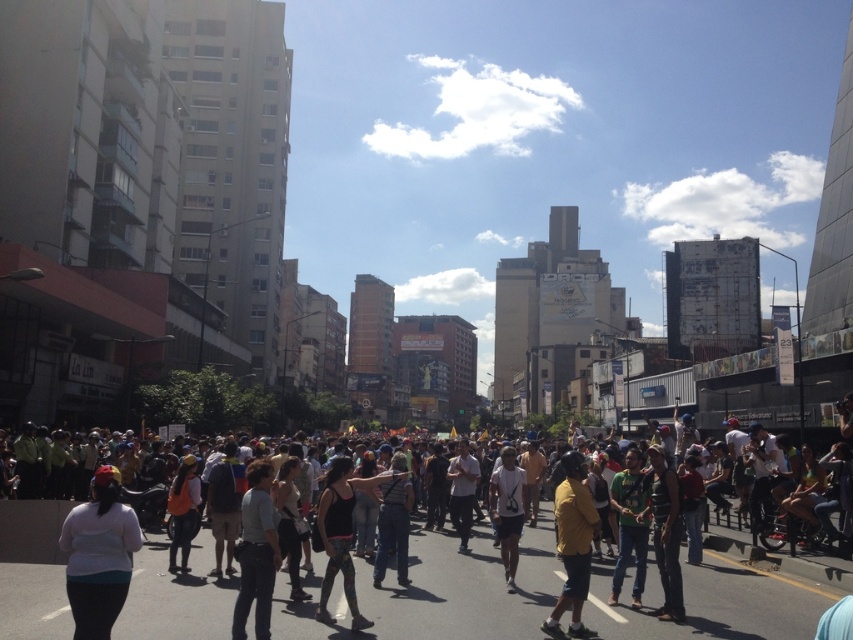
Question: Is multicolored casual attire at center behind white matte shirt at lower left?

Choices:
 (A) no
 (B) yes

Answer: (B)

Question: Which object appears closest to the camera in this image?

Choices:
 (A) white matte shirt at lower left
 (B) multicolored casual attire at center

Answer: (A)

Question: Which point appears closest to the camera in this image?

Choices:
 (A) (129, 579)
 (B) (500, 602)

Answer: (A)

Question: Can you confirm if multicolored casual attire at center is thinner than white matte shirt at lower left?

Choices:
 (A) no
 (B) yes

Answer: (A)

Question: Does multicolored casual attire at center have a lesser width compared to white matte shirt at lower left?

Choices:
 (A) yes
 (B) no

Answer: (B)

Question: Which object is farther from the camera taking this photo?

Choices:
 (A) white matte shirt at lower left
 (B) multicolored casual attire at center

Answer: (B)